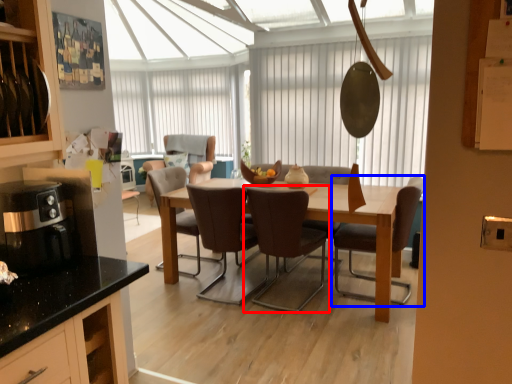
Question: Which of the following is the farthest to the observer, chair (highlighted by a red box) or chair (highlighted by a blue box)?

Choices:
 (A) chair
 (B) chair

Answer: (B)